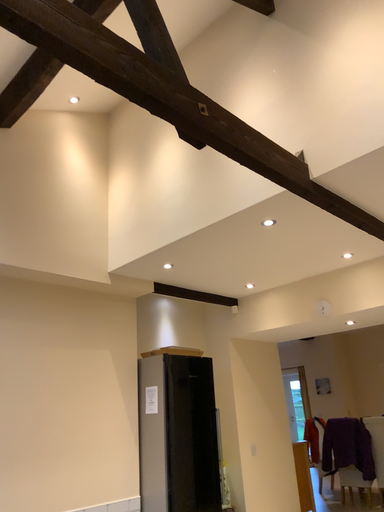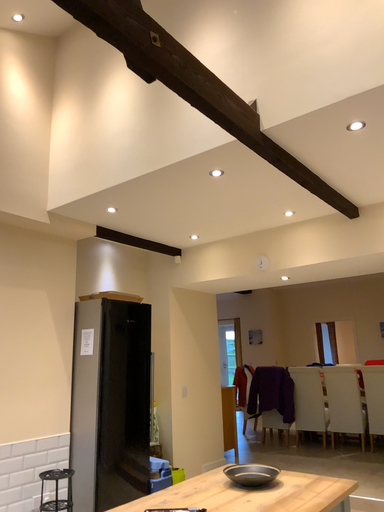
Question: How did the camera likely rotate when shooting the video?

Choices:
 (A) rotated right
 (B) rotated left

Answer: (A)